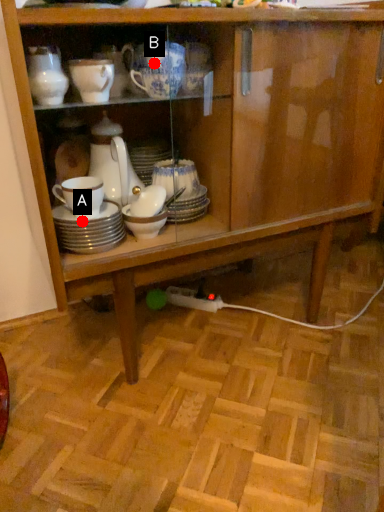
Question: Two points are circled on the image, labeled by A and B beside each circle. Which point is further to the camera?

Choices:
 (A) A is further
 (B) B is further

Answer: (A)